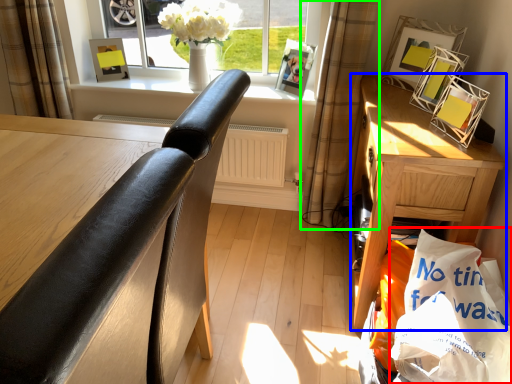
Question: Which is nearer to the shopping bag (highlighted by a red box)? nightstand (highlighted by a blue box) or curtain (highlighted by a green box).

Choices:
 (A) nightstand
 (B) curtain

Answer: (A)